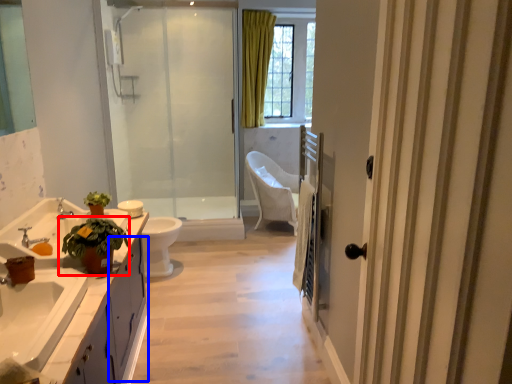
Question: Which point is further to the camera, houseplant (highlighted by a red box) or cabinetry (highlighted by a blue box)?

Choices:
 (A) houseplant
 (B) cabinetry

Answer: (B)